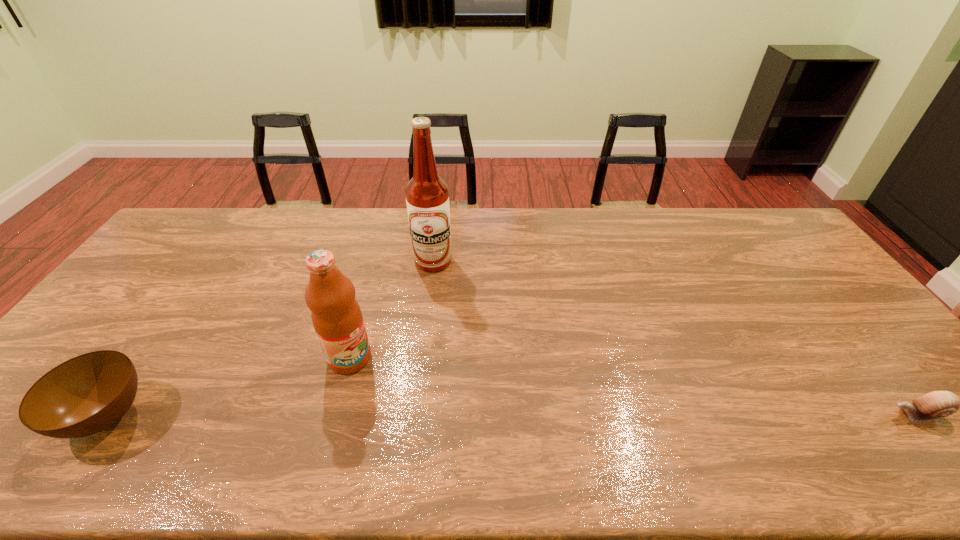
I want to click on object that is at the right edge, so click(x=936, y=404).

Find the location of a particular element. This screenshot has width=960, height=540. object that is at the near left corner is located at coordinates [82, 396].

Find the location of `object that is at the near right corner`. object that is at the near right corner is located at coordinates (936, 404).

Identify the location of vacant region at the far edge of the desktop. tap(355, 207).

You are a GUI agent. You are given a task and a screenshot of the screen. Output one action in this format:
    pyautogui.click(x=<x>, y=<y>)
    Task: Click on the vacant space at the right edge of the desktop
    Image resolution: width=960 pixels, height=540 pixels.
    Given the screenshot: What is the action you would take?
    point(807,301)

The image size is (960, 540). I want to click on vacant space at the far right corner of the desktop, so click(x=792, y=241).

I want to click on vacant space at the near right corner, so click(892, 405).

Locate an element on the screen. This screenshot has width=960, height=540. free space between the second shortest object and the alcohol is located at coordinates (270, 339).

This screenshot has width=960, height=540. What are the coordinates of `free spot between the bowl and the escargot` in the screenshot? It's located at (512, 415).

Image resolution: width=960 pixels, height=540 pixels. What are the coordinates of `vacant area between the third object from right to left and the bowl` in the screenshot? It's located at (228, 387).